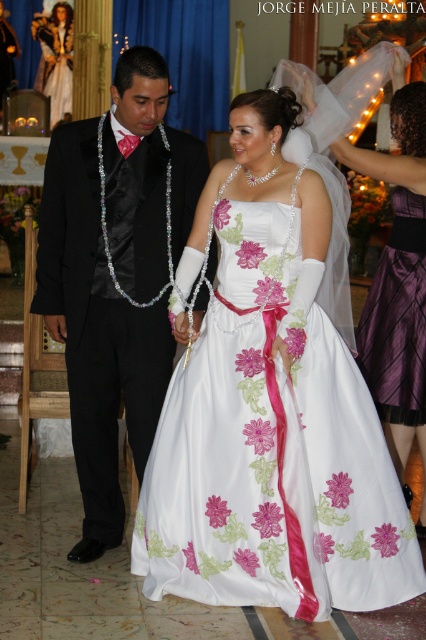
Question: Which of the following is the closest to the observer?

Choices:
 (A) (425, 291)
 (B) (129, 356)
 (C) (316, 602)

Answer: (C)

Question: Does satin floral dress at center have a greater width compared to black satin suit at left?

Choices:
 (A) yes
 (B) no

Answer: (A)

Question: Which object is positioned closest to the white satin dress at center?

Choices:
 (A) black satin suit at left
 (B) purple satin skirt at lower right
 (C) satin floral dress at center

Answer: (B)

Question: Is satin floral dress at center wider than purple satin skirt at lower right?

Choices:
 (A) no
 (B) yes

Answer: (B)

Question: Is black satin suit at left to the left of white satin dress at center from the viewer's perspective?

Choices:
 (A) yes
 (B) no

Answer: (A)

Question: Which object is farther from the camera taking this photo?

Choices:
 (A) black satin suit at left
 (B) satin floral dress at center
 (C) purple satin skirt at lower right
 (D) white satin dress at center

Answer: (C)